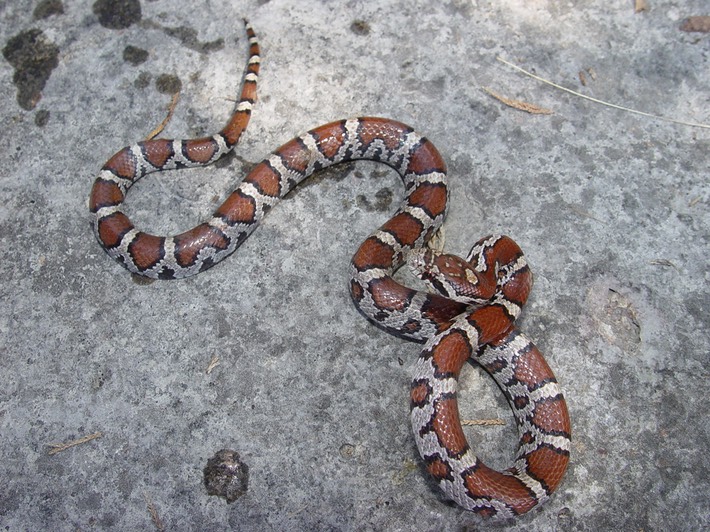
You are a GUI agent. You are given a task and a screenshot of the screen. Output one action in this format:
    pyautogui.click(x=<x>, y=<y>)
    Task: Click on the surface
    
    Given the screenshot: What is the action you would take?
    pyautogui.click(x=241, y=338), pyautogui.click(x=184, y=378)